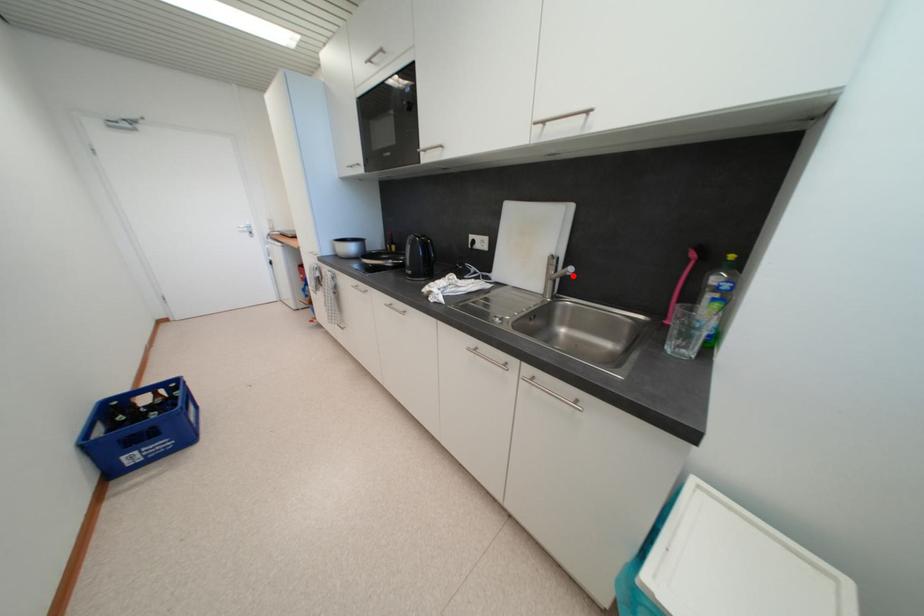
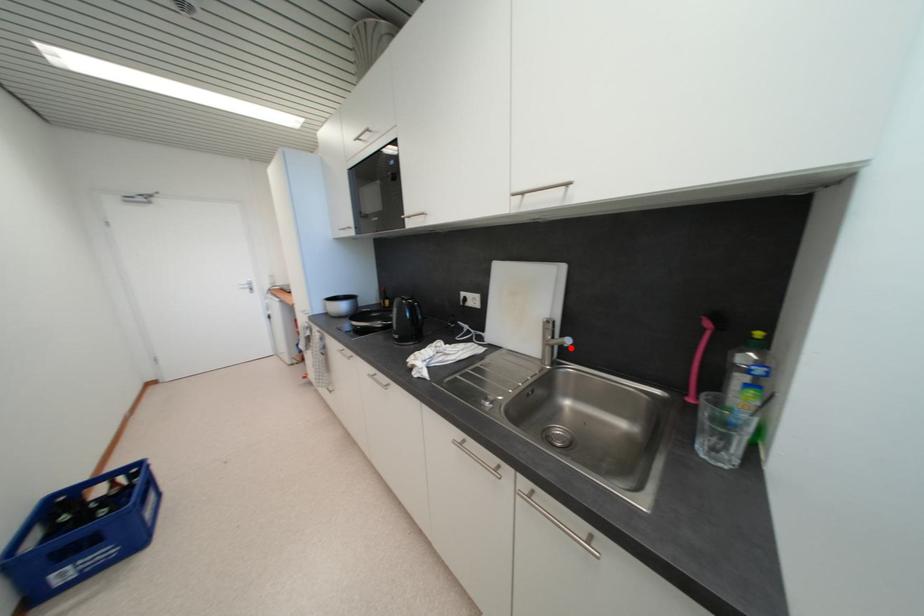
I am providing you with two images of the same scene from different viewpoints. A red point is marked on the first image and another point is marked on the second image. Do the highlighted points in image1 and image2 indicate the same real-world spot?

Yes